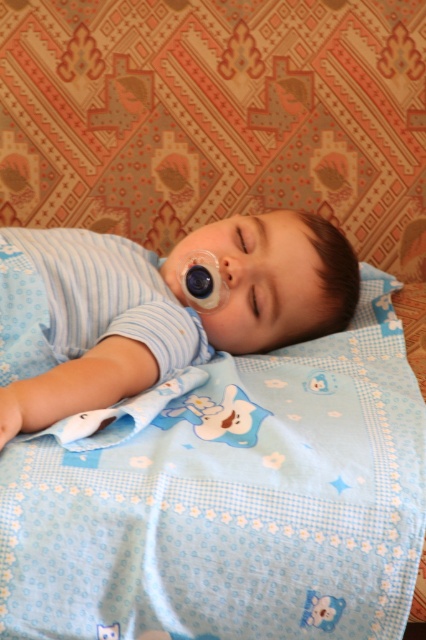
Question: Which point is closer to the camera taking this photo?

Choices:
 (A) pos(23,628)
 (B) pos(170,368)

Answer: (A)

Question: Which point appears closest to the camera in this image?

Choices:
 (A) 279,307
 (B) 201,401

Answer: (B)

Question: In this image, where is blue fabric blanket at center located relative to blue soft fabric at center?

Choices:
 (A) above
 (B) below

Answer: (B)

Question: Among these points, which one is nearest to the camera?

Choices:
 (A) (114, 611)
 (B) (287, 253)

Answer: (A)

Question: Does blue fabric blanket at center appear on the left side of blue soft fabric at center?

Choices:
 (A) no
 (B) yes

Answer: (A)

Question: Does blue fabric blanket at center appear under blue soft fabric at center?

Choices:
 (A) no
 (B) yes

Answer: (B)